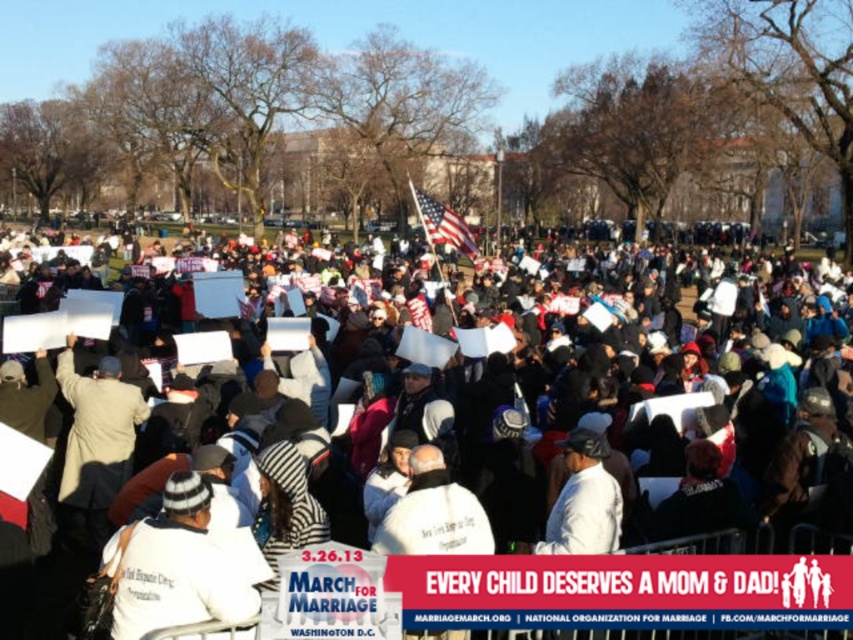
Question: Based on their relative distances, which object is farther from the white paper signs at center?

Choices:
 (A) white fleece jacket at lower left
 (B) white matte jacket at center

Answer: (A)

Question: Which object is farther from the camera taking this photo?

Choices:
 (A) white fleece jacket at lower left
 (B) white matte jacket at center

Answer: (B)

Question: Is white fleece jacket at lower left closer to the viewer compared to white matte jacket at center?

Choices:
 (A) yes
 (B) no

Answer: (A)

Question: Observing the image, what is the correct spatial positioning of white paper signs at center in reference to white matte jacket at center?

Choices:
 (A) below
 (B) above

Answer: (B)

Question: Which point is farther to the camera?

Choices:
 (A) (132, 528)
 (B) (654, 451)
 (C) (602, 547)

Answer: (B)

Question: Considering the relative positions of white fleece jacket at lower left and white matte jacket at center in the image provided, where is white fleece jacket at lower left located with respect to white matte jacket at center?

Choices:
 (A) right
 (B) left

Answer: (B)